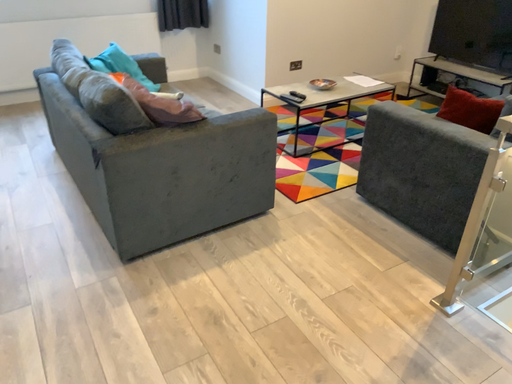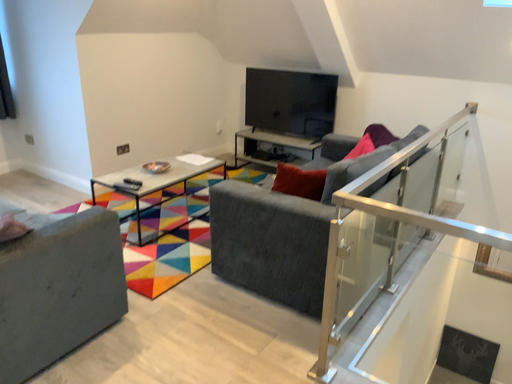
Question: How did the camera likely rotate when shooting the video?

Choices:
 (A) rotated right
 (B) rotated left

Answer: (A)